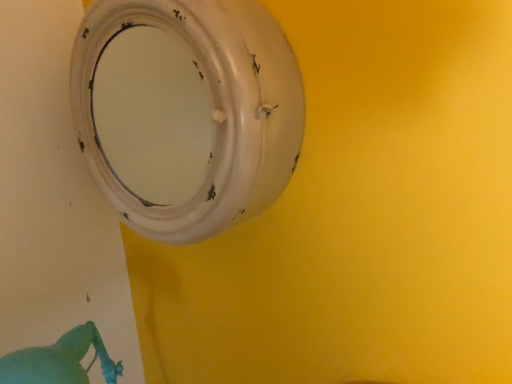
Describe the element at coordinates (212, 112) in the screenshot. I see `white glossy toilet at upper center` at that location.

The width and height of the screenshot is (512, 384). Find the location of `white glossy toilet at upper center`. white glossy toilet at upper center is located at coordinates (212, 112).

The height and width of the screenshot is (384, 512). Find the location of `white glossy toilet at upper center`. white glossy toilet at upper center is located at coordinates (212, 112).